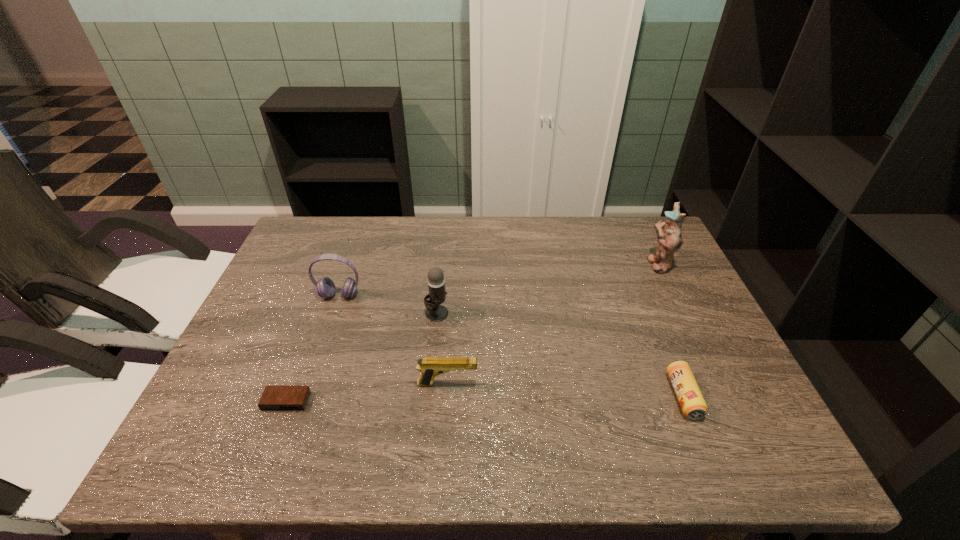
At what (x,y) coordinates should I click in order to perform the action: click on free space between the tallest object and the headset. Please return your answer as a coordinate pair (x, y). Looking at the image, I should click on (498, 280).

Find the location of `vacant region between the third shortest object and the beer can`. vacant region between the third shortest object and the beer can is located at coordinates (565, 390).

Locate an element on the screen. empty space between the headset and the fifth tallest object is located at coordinates [512, 346].

Where is `free space between the second shortest object and the shortest object`? The width and height of the screenshot is (960, 540). free space between the second shortest object and the shortest object is located at coordinates (485, 399).

This screenshot has height=540, width=960. Find the location of `free space between the rightmost object and the fourth tallest object`. free space between the rightmost object and the fourth tallest object is located at coordinates 553,324.

What are the coordinates of `vacant point located between the beer can and the alarm clock` in the screenshot? It's located at (x=485, y=399).

Point out which object is positioned as the second nearest to the beer can. Please provide its 2D coordinates. Your answer should be formatted as a tuple, i.e. [(x, y)], where the tuple contains the x and y coordinates of a point satisfying the conditions above.

[(429, 367)]

The width and height of the screenshot is (960, 540). Identify the location of object that is the second closest to the headset. (274, 398).

Where is `free location that satisfies the following two spatial constraints: 1. on the headband and ear cups of the microphone; 2. on the left side of the headset`? The width and height of the screenshot is (960, 540). free location that satisfies the following two spatial constraints: 1. on the headband and ear cups of the microphone; 2. on the left side of the headset is located at coordinates (333, 313).

Find the location of `vacant space that satisfies the following two spatial constraints: 1. on the headband and ear cups of the headset; 2. on the right side of the microphone`. vacant space that satisfies the following two spatial constraints: 1. on the headband and ear cups of the headset; 2. on the right side of the microphone is located at coordinates (333, 313).